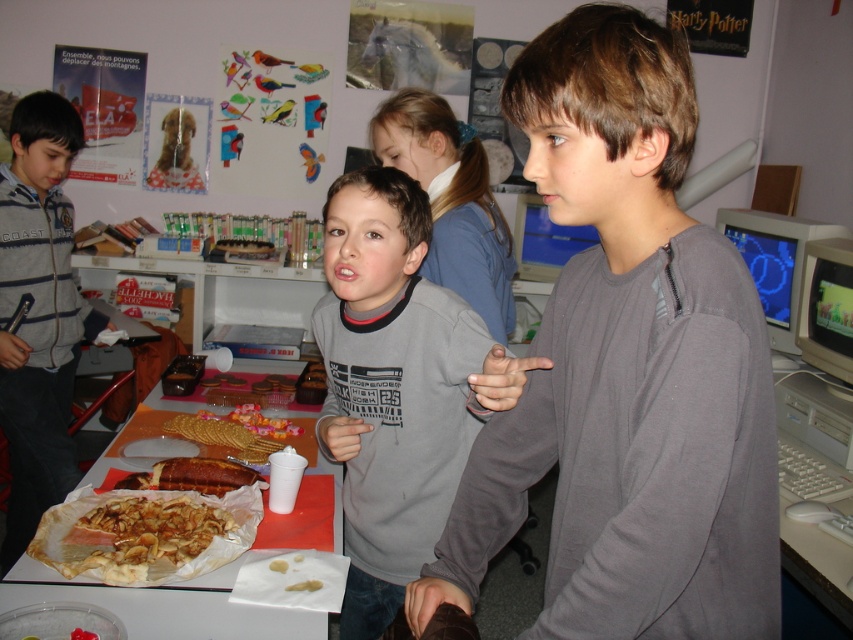
Question: Does striped fleece jacket at left lie in front of pink sugary cookies at center?

Choices:
 (A) yes
 (B) no

Answer: (B)

Question: Which of the following is the closest to the observer?

Choices:
 (A) tap(622, 452)
 (B) tap(544, 275)

Answer: (A)

Question: Is gray matte shirt at center closer to camera compared to white paper plate at center?

Choices:
 (A) no
 (B) yes

Answer: (B)

Question: Which point is closer to the camera taking this photo?

Choices:
 (A) (521, 250)
 (B) (310, 436)

Answer: (B)

Question: Which object is closer to the camera taking this photo?

Choices:
 (A) white paper plate at center
 (B) pink sugary cookies at center

Answer: (A)

Question: Is striped fleece jacket at left closer to the viewer compared to matte plastic tray at center?

Choices:
 (A) yes
 (B) no

Answer: (A)